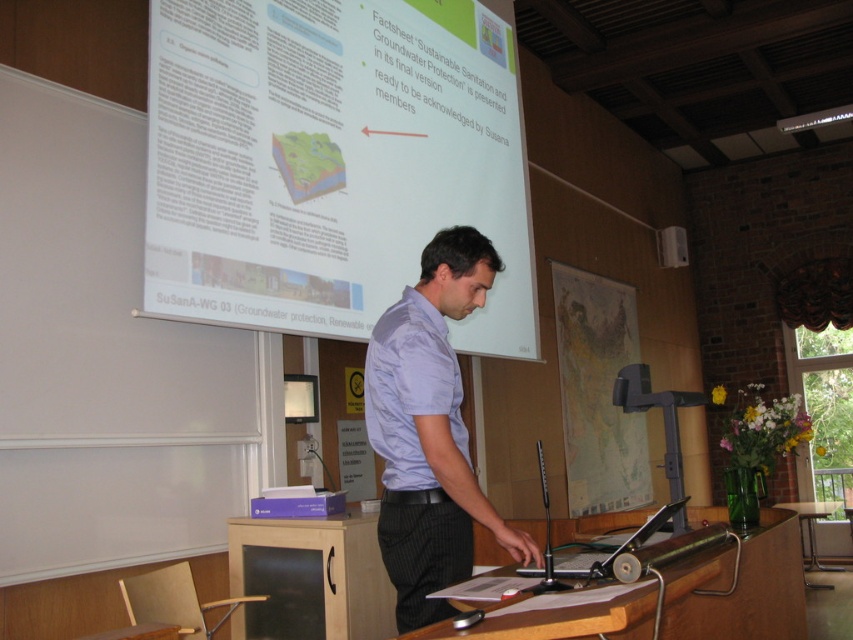
You are an event organizer who needs to ensure that all materials are visible to the audience. Given the scene described, which object between the white paper at upper center and the light blue shirt at center is larger and might block the view of the other?

The white paper at upper center is bigger than the light blue shirt at center, so it might block the view of the light blue shirt at center.

You are standing in a conference room and see a point marked at coordinates (726, 637). If you want to place a 2.0 meter long banner from this point to the wall behind the podium, will it fit?

The distance of point (726, 637) from viewer is 1.98 meters, so the banner will not fit because it is only 1.98 meters away from the point to the wall, which is shorter than the banner length of 2.0 meters.

You are organizing a conference and need to place a laptop on the wooden at center and a projector remote on the wooden table at center. Which surface is wider and can accommodate the laptop more comfortably?

The wooden at center is wider than the wooden table at center, so the laptop can be placed more comfortably on the wooden at center.